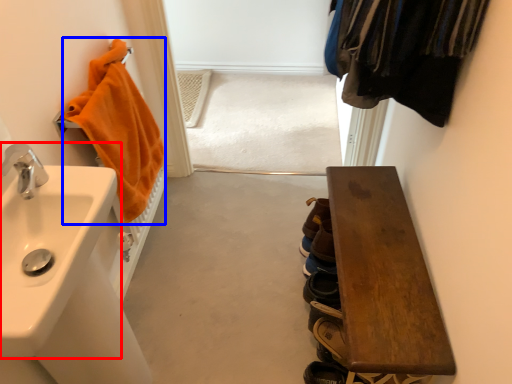
Question: Which object is further to the camera taking this photo, sink (highlighted by a red box) or bath towel (highlighted by a blue box)?

Choices:
 (A) sink
 (B) bath towel

Answer: (B)